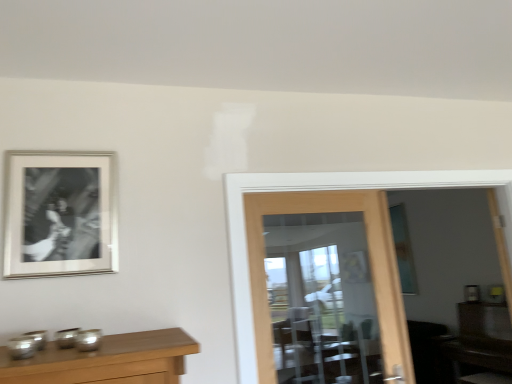
Question: Should I look upward or downward to see brown wooden dresser at lower right?

Choices:
 (A) down
 (B) up

Answer: (A)

Question: Can you confirm if brown wooden dresser at lower right is smaller than clear glass door at center?

Choices:
 (A) yes
 (B) no

Answer: (B)

Question: Is brown wooden dresser at lower right facing towards clear glass door at center?

Choices:
 (A) no
 (B) yes

Answer: (A)

Question: From the image's perspective, does brown wooden dresser at lower right appear higher than clear glass door at center?

Choices:
 (A) no
 (B) yes

Answer: (A)

Question: Is brown wooden dresser at lower right surrounding clear glass door at center?

Choices:
 (A) no
 (B) yes

Answer: (A)

Question: Is brown wooden dresser at lower right shorter than clear glass door at center?

Choices:
 (A) yes
 (B) no

Answer: (A)

Question: Is brown wooden dresser at lower right behind clear glass door at center?

Choices:
 (A) yes
 (B) no

Answer: (A)

Question: Does clear glass door at center have a greater height compared to brown wooden dresser at lower right?

Choices:
 (A) yes
 (B) no

Answer: (A)

Question: Can you confirm if clear glass door at center is positioned to the left of brown wooden dresser at lower right?

Choices:
 (A) no
 (B) yes

Answer: (B)

Question: Is clear glass door at center shorter than brown wooden dresser at lower right?

Choices:
 (A) yes
 (B) no

Answer: (B)

Question: Can you confirm if clear glass door at center is positioned to the right of brown wooden dresser at lower right?

Choices:
 (A) yes
 (B) no

Answer: (B)

Question: From a real-world perspective, is clear glass door at center below brown wooden dresser at lower right?

Choices:
 (A) yes
 (B) no

Answer: (B)

Question: From a real-world perspective, is clear glass door at center located higher than brown wooden dresser at lower right?

Choices:
 (A) no
 (B) yes

Answer: (B)

Question: From the image's perspective, is silver/metallic photo frame at upper left located beneath clear glass door at center?

Choices:
 (A) no
 (B) yes

Answer: (A)